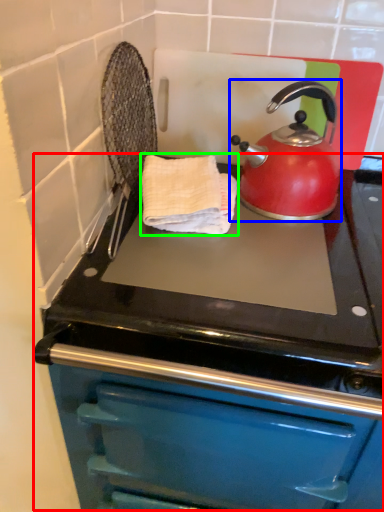
Question: Which is nearer to the oven (highlighted by a red box)? kettle (highlighted by a blue box) or hand towel (highlighted by a green box).

Choices:
 (A) kettle
 (B) hand towel

Answer: (B)